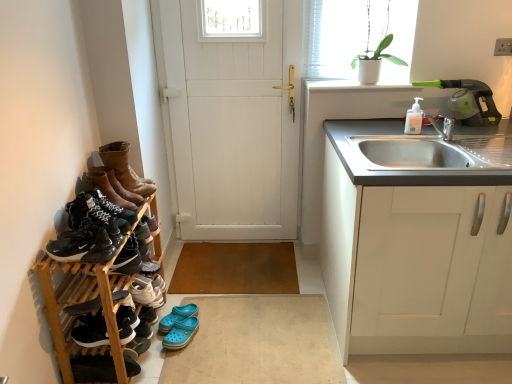
Locate an element on the screen. This screenshot has width=512, height=384. vacant space that's between blue rubber clogs at lower center and blue rubber clogs at lower center, arranged as the third footwear when ordered from the bottom is located at coordinates click(161, 338).